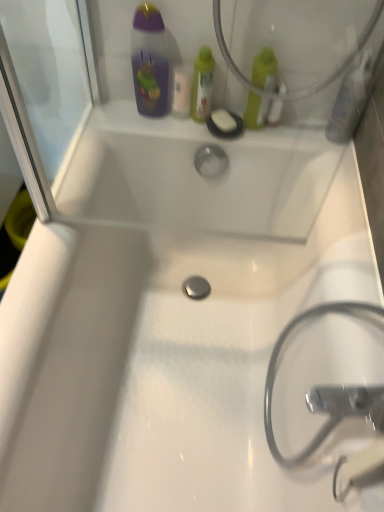
Question: Are metallic silver hose at lower right and translucent plastic mouthwash at upper right, the 5th mouthwash positioned from the left, beside each other?

Choices:
 (A) no
 (B) yes

Answer: (A)

Question: Is metallic silver hose at lower right thinner than translucent plastic mouthwash at upper right, arranged as the first mouthwash when viewed from the right?

Choices:
 (A) yes
 (B) no

Answer: (B)

Question: From the image's perspective, does metallic silver hose at lower right appear higher than translucent plastic mouthwash at upper right, arranged as the first mouthwash when viewed from the right?

Choices:
 (A) no
 (B) yes

Answer: (A)

Question: Is metallic silver hose at lower right facing towards translucent plastic mouthwash at upper right, the 5th mouthwash positioned from the left?

Choices:
 (A) yes
 (B) no

Answer: (B)

Question: Is metallic silver hose at lower right at the left side of translucent plastic mouthwash at upper right, the 5th mouthwash positioned from the left?

Choices:
 (A) yes
 (B) no

Answer: (A)

Question: From a real-world perspective, is green plastic bottle at upper center, the fourth mouthwash positioned from the right, positioned above or below green matte bottle at upper right, arranged as the 3th mouthwash when viewed from the right?

Choices:
 (A) above
 (B) below

Answer: (B)

Question: Do you think green plastic bottle at upper center, which ranks as the second mouthwash in left-to-right order, is within green matte bottle at upper right, placed as the 3th mouthwash when sorted from left to right, or outside of it?

Choices:
 (A) outside
 (B) inside

Answer: (A)

Question: In the image, is green plastic bottle at upper center, the fourth mouthwash positioned from the right, on the left side or the right side of green matte bottle at upper right, placed as the 3th mouthwash when sorted from left to right?

Choices:
 (A) left
 (B) right

Answer: (A)

Question: Is point (195, 58) closer or farther from the camera than point (254, 62)?

Choices:
 (A) closer
 (B) farther

Answer: (B)

Question: Is translucent plastic mouthwash at upper center, positioned as the first mouthwash in left-to-right order, in front of or behind green plastic bottle at upper center, which ranks as the second mouthwash in left-to-right order, in the image?

Choices:
 (A) front
 (B) behind

Answer: (B)

Question: Is translucent plastic mouthwash at upper center, which appears as the fifth mouthwash when viewed from the right, situated inside green plastic bottle at upper center, the fourth mouthwash positioned from the right, or outside?

Choices:
 (A) inside
 (B) outside

Answer: (B)

Question: Considering the relative positions of translucent plastic mouthwash at upper center, positioned as the first mouthwash in left-to-right order, and green plastic bottle at upper center, the fourth mouthwash positioned from the right, in the image provided, is translucent plastic mouthwash at upper center, positioned as the first mouthwash in left-to-right order, to the left or to the right of green plastic bottle at upper center, the fourth mouthwash positioned from the right,?

Choices:
 (A) left
 (B) right

Answer: (A)

Question: Is point (175, 110) positioned closer to the camera than point (203, 95)?

Choices:
 (A) farther
 (B) closer

Answer: (A)

Question: In terms of width, does green plastic bottle at upper center, the fourth mouthwash positioned from the right, look wider or thinner when compared to translucent plastic mouthwash at upper center, which appears as the fifth mouthwash when viewed from the right?

Choices:
 (A) thin
 (B) wide

Answer: (B)

Question: Visually, is green plastic bottle at upper center, the fourth mouthwash positioned from the right, positioned to the left or to the right of translucent plastic mouthwash at upper center, which appears as the fifth mouthwash when viewed from the right?

Choices:
 (A) left
 (B) right

Answer: (B)